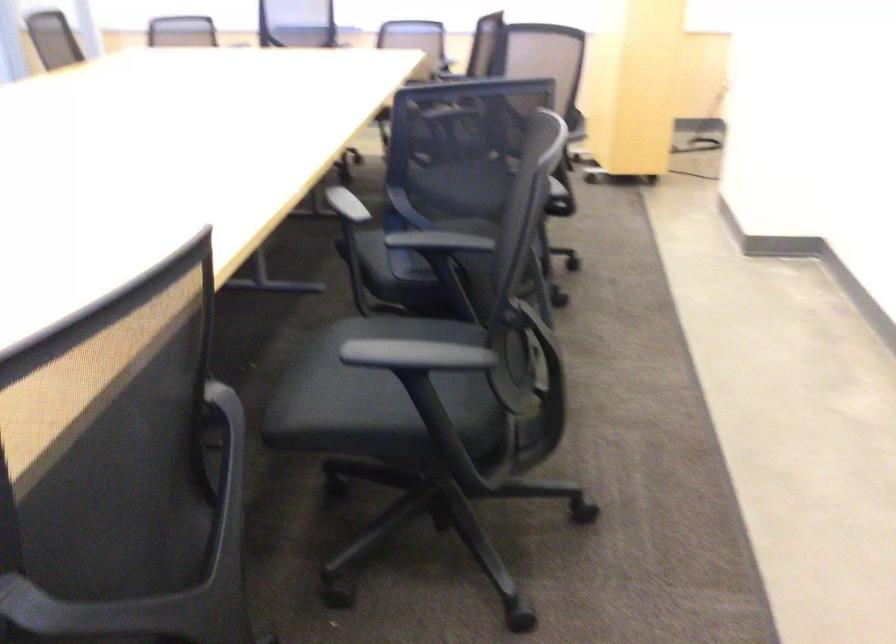
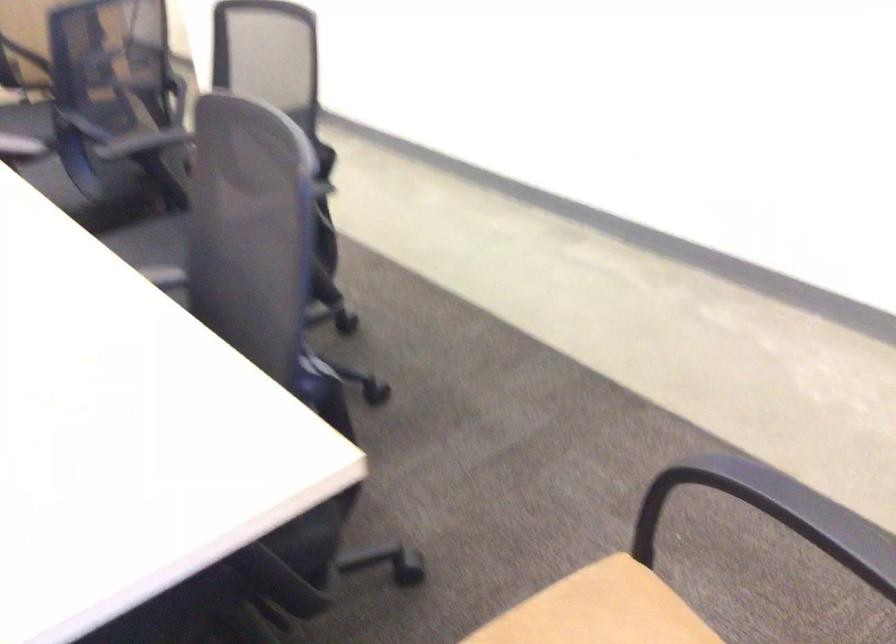
In the second image, find the point that corresponds to point 204,391 in the first image.

(165, 275)